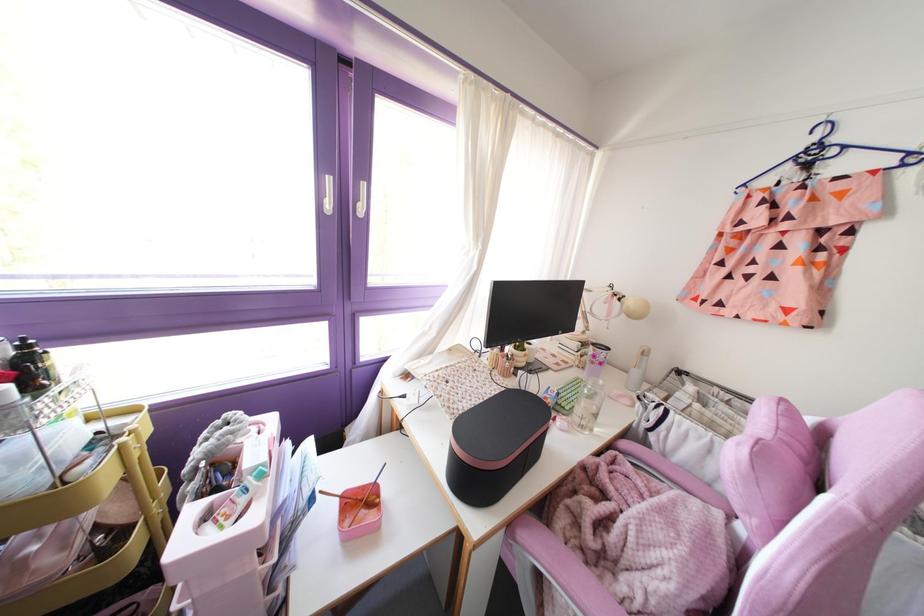
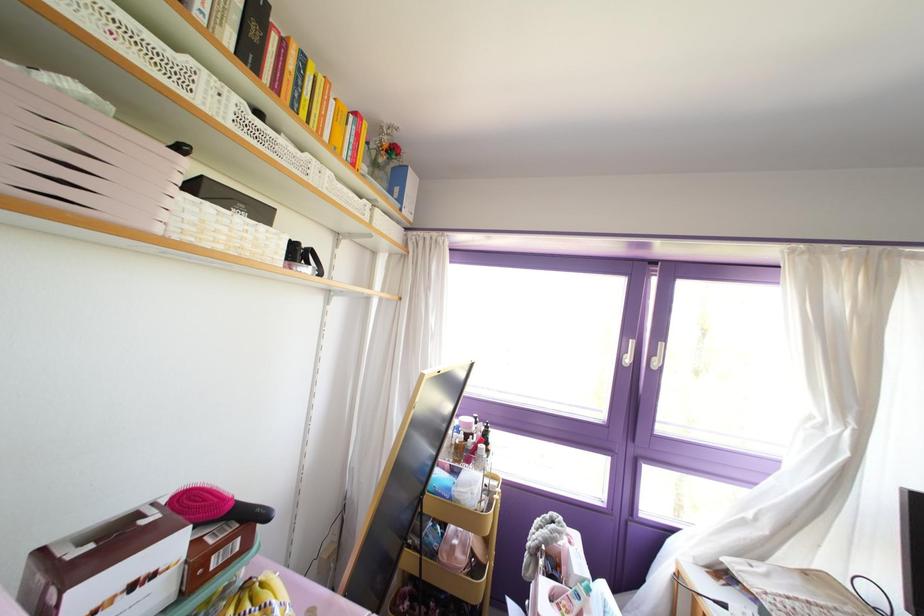
First-person continuous shooting, in which direction is the camera rotating?

The camera rotated toward left-up.